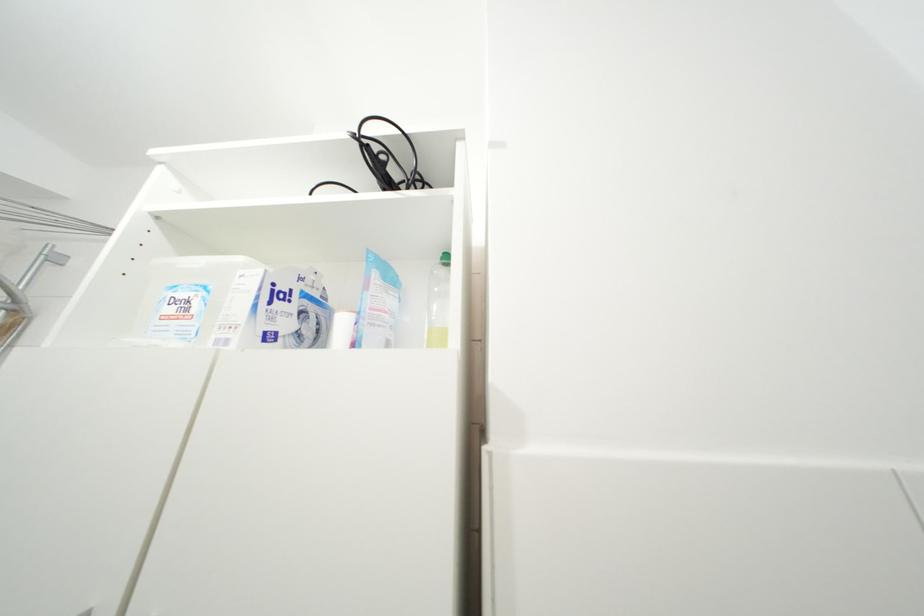
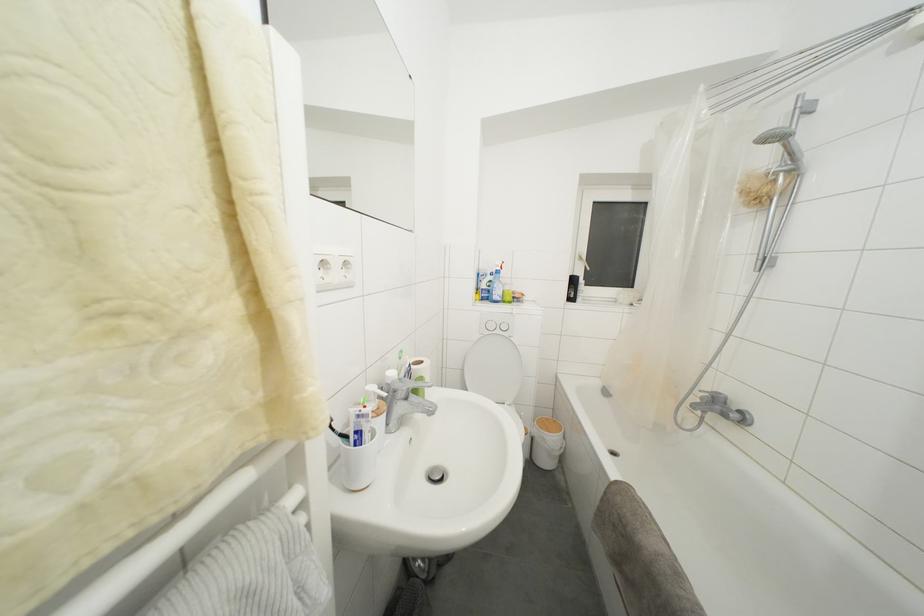
Question: The camera is either moving clockwise (left) or counter-clockwise (right) around the object. The first image is from the beginning of the video and the second image is from the end. Is the camera moving left or right when shooting the video?

Choices:
 (A) Left
 (B) Right

Answer: (B)